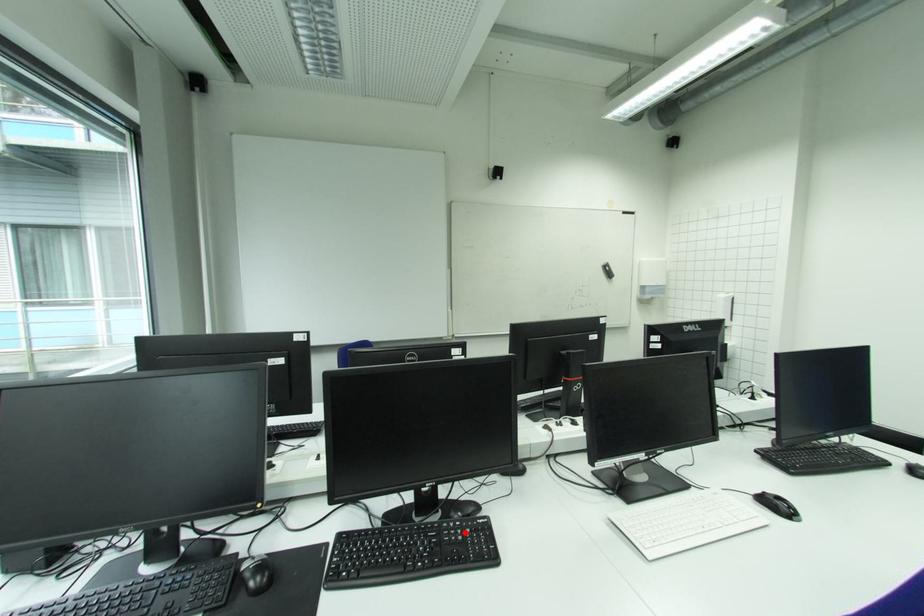
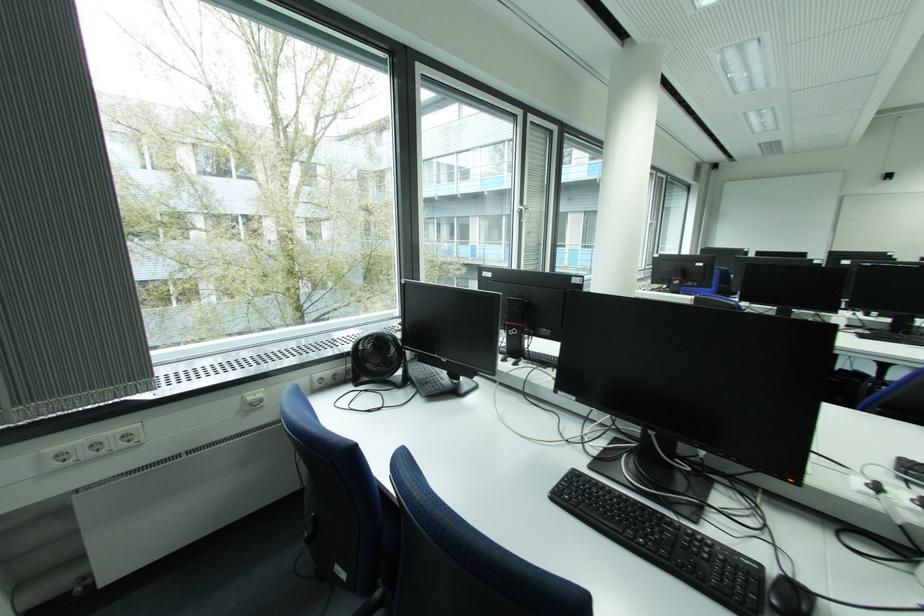
Question: I am providing you with two images of the same scene from different viewpoints. A red point is marked on the first image. Is the red point's position out of view in image 2?

Choices:
 (A) Yes
 (B) No

Answer: (A)